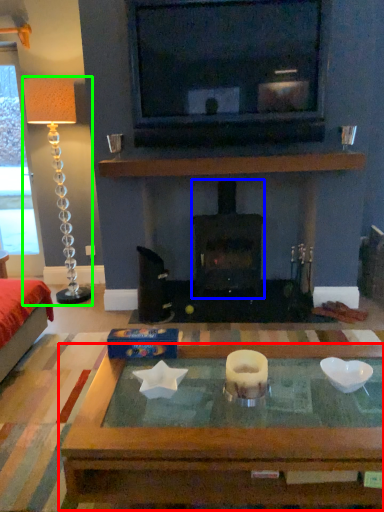
Question: Considering the real-world distances, which object is farthest from coffee table (highlighted by a red box)? wood burning stove (highlighted by a blue box) or lamp (highlighted by a green box)?

Choices:
 (A) wood burning stove
 (B) lamp

Answer: (B)